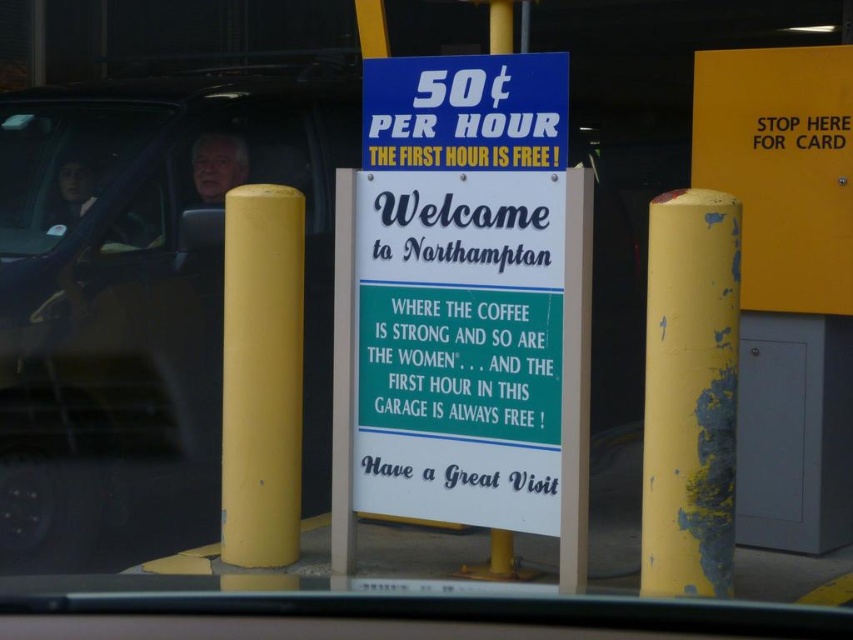
You are driving a matte black suv at left and want to park under the yellow matte sign at right. Is your current position already under the sign?

The matte black suv at left is positioned under the yellow matte sign at right, so yes, the matte black suv at left is already parked under the yellow matte sign at right.

You are a driver who just parked your car and noticed the yellow matte pole at left and the matte black car window at left. Which object takes up more space in the scene?

The matte black car window at left takes up more space in the scene than the yellow matte pole at left.

You are a driver entering the parking garage and see the yellow matte pole at left and the matte black car window at left. Which object is closer to the ground?

The yellow matte pole at left is located below the matte black car window at left, so it is closer to the ground.